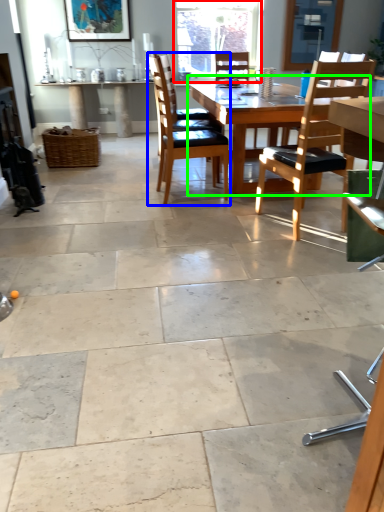
Question: Which is nearer to the window (highlighted by a red box)? chair (highlighted by a blue box) or kitchen & dining room table (highlighted by a green box).

Choices:
 (A) chair
 (B) kitchen & dining room table

Answer: (A)